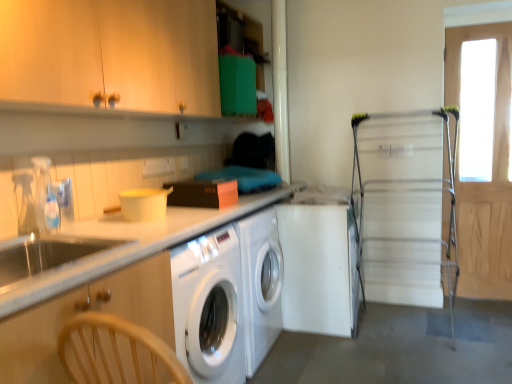
In order to click on vacant space to the right of metallic silver drying rack at right, placed as the 1th screen door when sorted from left to right in this screenshot , I will do `click(476, 330)`.